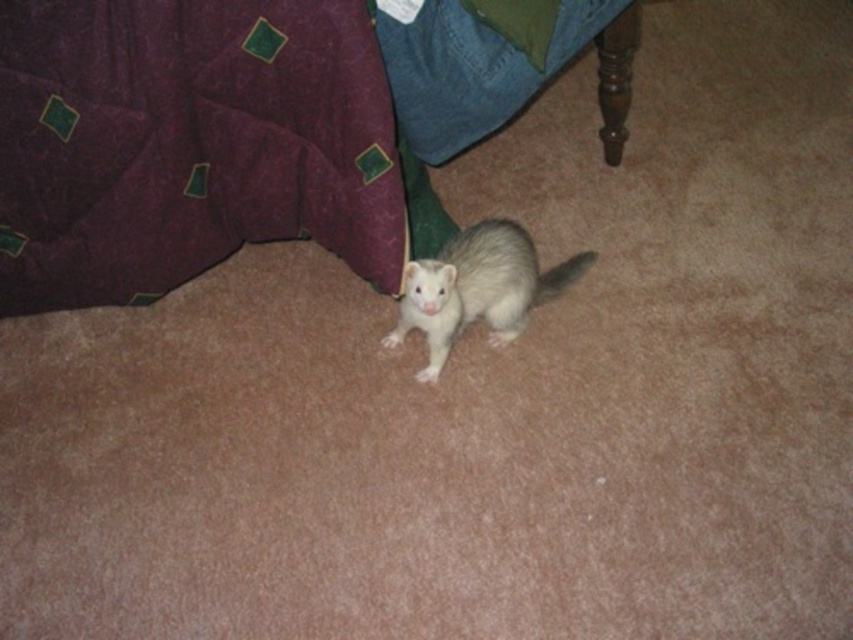
You are a photographer setting up a shot of the white fur ferret at center and the white fur tail at center. You want to position a small prop between them. Based on their positions, where should you place the prop to ensure it is between both objects?

The white fur ferret at center is to the left of the white fur tail at center, so you should place the prop between the white fur ferret at center and the white fur tail at center, closer to the middle of their positions.